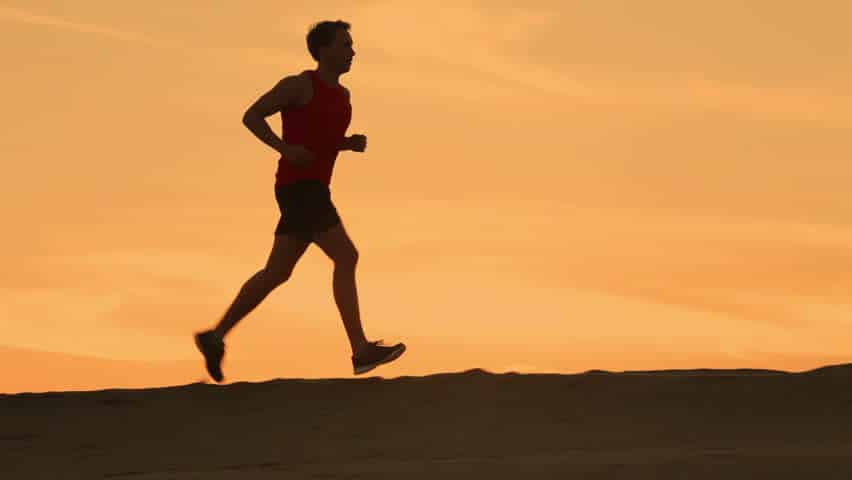
Locate an element on the screen. chest is located at coordinates (334, 105).